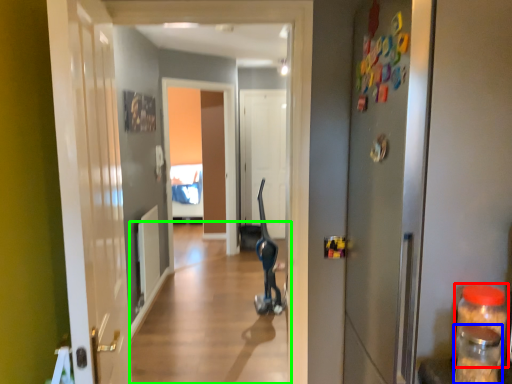
Question: Which object is positioned closest to bottle (highlighted by a red box)? Select from bottle (highlighted by a blue box) and alley (highlighted by a green box).

Choices:
 (A) bottle
 (B) alley

Answer: (A)